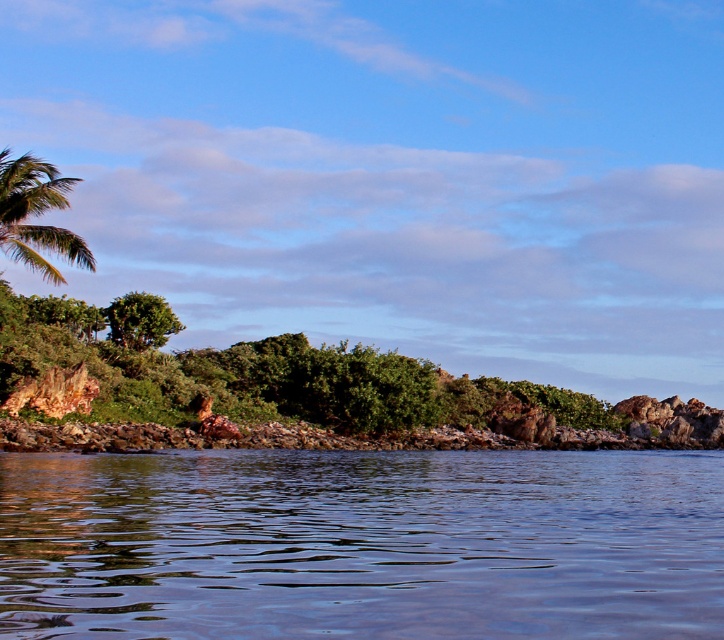
Question: Does transparent water at center have a lesser width compared to green leafy palm tree at upper left?

Choices:
 (A) yes
 (B) no

Answer: (A)

Question: Is transparent water at center below green leafy palm tree at upper left?

Choices:
 (A) yes
 (B) no

Answer: (A)

Question: Which of the following is the closest to the observer?

Choices:
 (A) (42, 248)
 (B) (135, 513)

Answer: (B)

Question: Is transparent water at center to the right of green leafy palm tree at upper left from the viewer's perspective?

Choices:
 (A) yes
 (B) no

Answer: (A)

Question: Which object is farther from the camera taking this photo?

Choices:
 (A) transparent water at center
 (B) green leafy palm tree at upper left

Answer: (B)